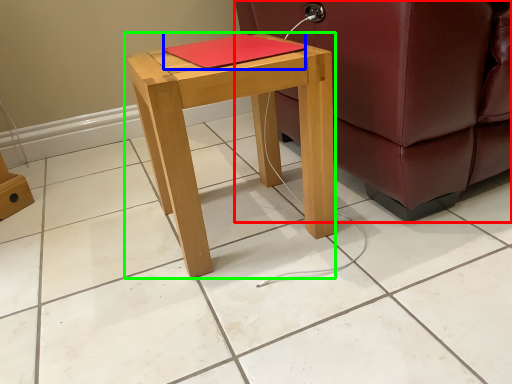
Question: Estimate the real-world distances between objects in this image. Which object is farther from studio couch (highlighted by a red box), notebook (highlighted by a blue box) or stool (highlighted by a green box)?

Choices:
 (A) notebook
 (B) stool

Answer: (A)